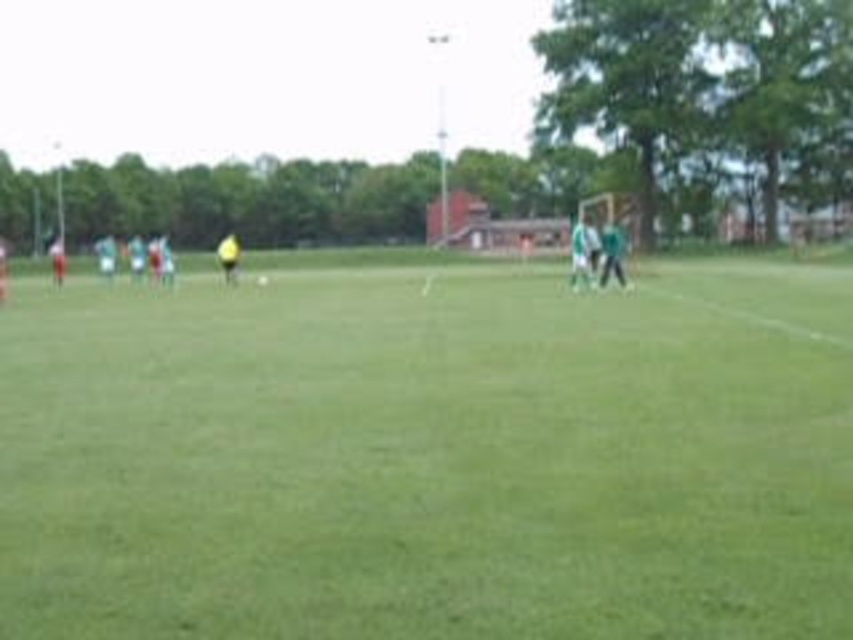
You are a soccer coach observing the field. You need to determine which object occupies more space in the image between the green grass field at center and the green matte shirt at right. Which one is larger?

The green grass field at center is larger in size than the green matte shirt at right, so the green grass field at center occupies more space in the image.

You are a soccer coach observing the field. You notice the green grass field at center and the green matte shirt at right. Which object occupies more horizontal space in the image?

The green grass field at center occupies more horizontal space because its width is larger than that of the green matte shirt at right.